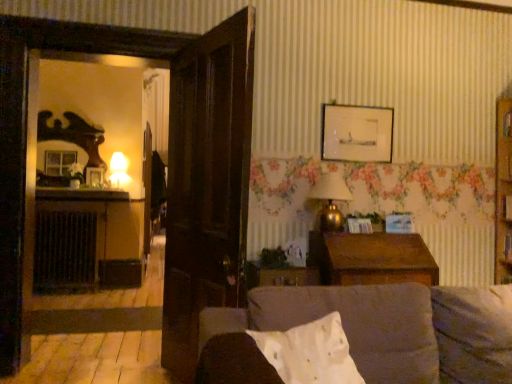
Question: Can you confirm if white cotton pillow at center is bigger than matte glass lamp at left, acting as the first lamp starting from the back?

Choices:
 (A) yes
 (B) no

Answer: (A)

Question: Considering the relative positions of white cotton pillow at center and matte glass lamp at left, placed as the second lamp when sorted from bottom to top, in the image provided, is white cotton pillow at center to the left of matte glass lamp at left, placed as the second lamp when sorted from bottom to top, from the viewer's perspective?

Choices:
 (A) no
 (B) yes

Answer: (A)

Question: Does white cotton pillow at center have a greater height compared to matte glass lamp at left, placed as the first lamp when sorted from top to bottom?

Choices:
 (A) no
 (B) yes

Answer: (A)

Question: Can you confirm if white cotton pillow at center is smaller than matte glass lamp at left, which ranks as the 1th lamp in left-to-right order?

Choices:
 (A) yes
 (B) no

Answer: (B)

Question: From a real-world perspective, is white cotton pillow at center on top of matte glass lamp at left, placed as the 2th lamp when sorted from right to left?

Choices:
 (A) yes
 (B) no

Answer: (B)

Question: Does white cotton pillow at center lie in front of matte glass lamp at left, which ranks as the 1th lamp in left-to-right order?

Choices:
 (A) yes
 (B) no

Answer: (A)

Question: Can you confirm if matte glass picture frame at left, which is the second picture frame from right to left, is positioned to the right of gold metallic lamp at upper right, the first lamp when ordered from front to back?

Choices:
 (A) yes
 (B) no

Answer: (B)

Question: Can you confirm if matte glass picture frame at left, which is the second picture frame from top to bottom, is smaller than gold metallic lamp at upper right, which is the 2th lamp from left to right?

Choices:
 (A) no
 (B) yes

Answer: (B)

Question: Is matte glass picture frame at left, which is the second picture frame from right to left, taller than gold metallic lamp at upper right, which is the 1th lamp from bottom to top?

Choices:
 (A) yes
 (B) no

Answer: (B)

Question: Is matte glass picture frame at left, which is the second picture frame from right to left, thinner than gold metallic lamp at upper right, marked as the 1th lamp in a right-to-left arrangement?

Choices:
 (A) no
 (B) yes

Answer: (B)

Question: Considering the relative sizes of matte glass picture frame at left, which ranks as the first picture frame in bottom-to-top order, and gold metallic lamp at upper right, which is counted as the 2th lamp, starting from the back, in the image provided, is matte glass picture frame at left, which ranks as the first picture frame in bottom-to-top order, wider than gold metallic lamp at upper right, which is counted as the 2th lamp, starting from the back,?

Choices:
 (A) yes
 (B) no

Answer: (B)

Question: Are matte glass picture frame at left, marked as the second picture frame in a front-to-back arrangement, and gold metallic lamp at upper right, which is the 2th lamp from left to right, beside each other?

Choices:
 (A) no
 (B) yes

Answer: (A)

Question: Is the position of matte glass lamp at left, placed as the 2th lamp when sorted from right to left, more distant than that of gold metallic lamp at upper right, the first lamp when ordered from front to back?

Choices:
 (A) no
 (B) yes

Answer: (B)